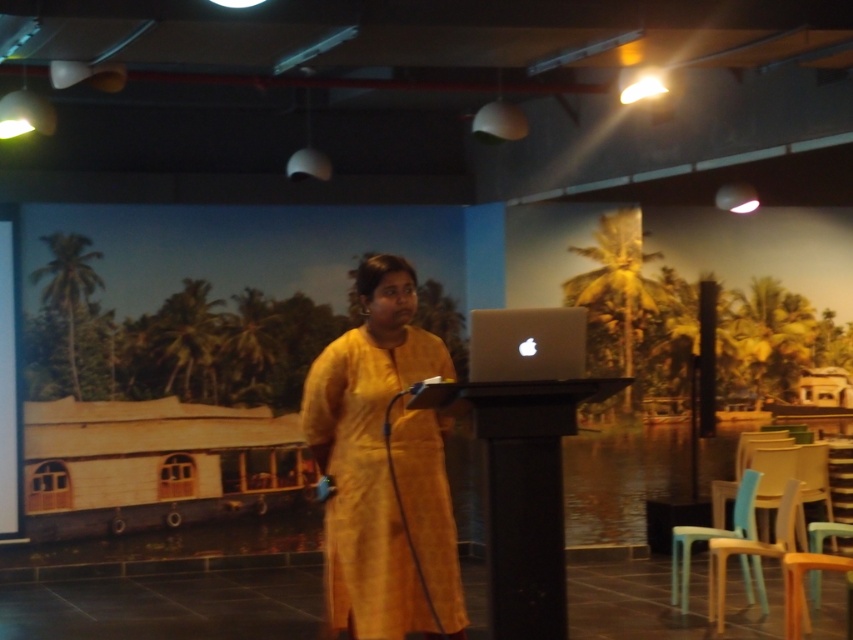
Is yellow textured dress at center bigger than silver metallic laptop at center?

Yes.

Is yellow textured dress at center wider than silver metallic laptop at center?

Yes.

Does point (432, 595) lie in front of point (491, 352)?

That is False.

Identify the location of yellow textured dress at center. The image size is (853, 640). (369, 454).